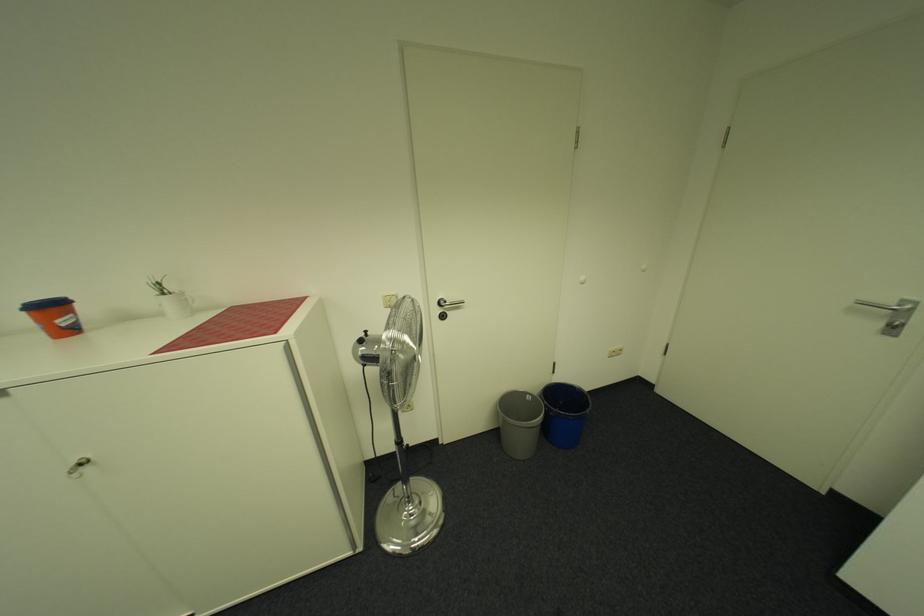
What are the coordinates of `key in lock` in the screenshot? It's located at (78, 467).